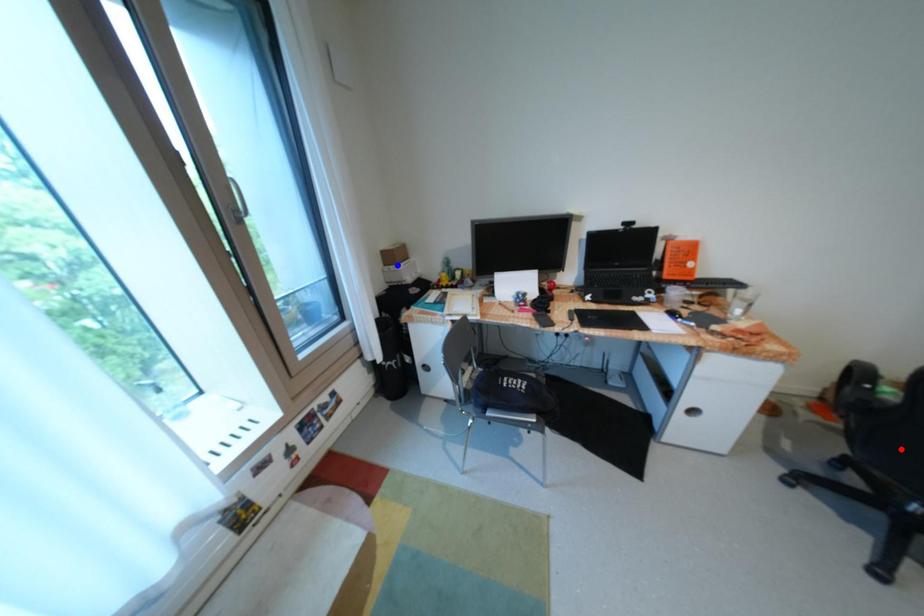
Question: Two points are marked on the image. Which point is closer to the camera?

Choices:
 (A) Blue point is closer.
 (B) Red point is closer.

Answer: (B)